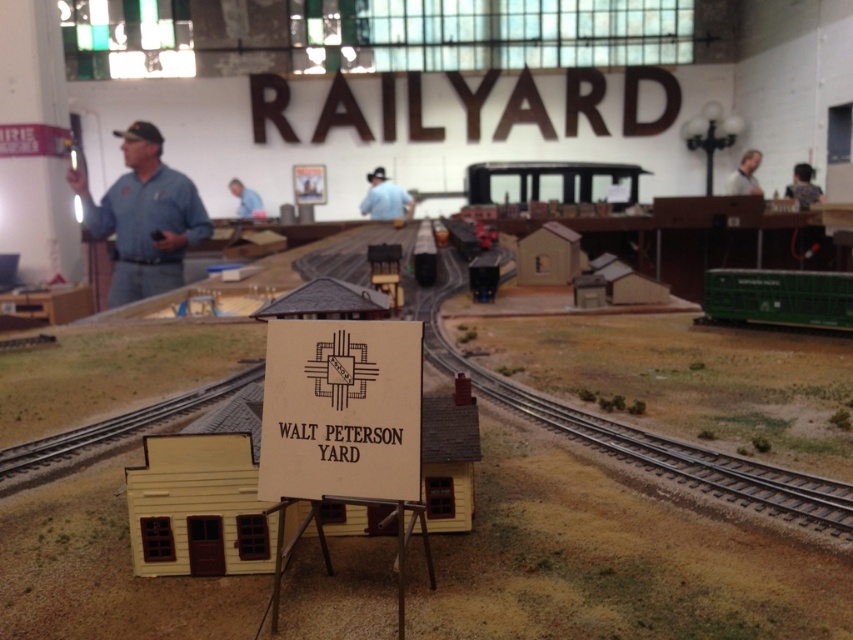
Question: Among these objects, which one is nearest to the camera?

Choices:
 (A) green matte freight car at right
 (B) blue shirt at upper center
 (C) blue uniform at center
 (D) brown cardboard sign at center

Answer: (D)

Question: Does green matte freight car at right lie in front of blue shirt at upper center?

Choices:
 (A) no
 (B) yes

Answer: (B)

Question: Can you confirm if green matte freight car at right is positioned to the right of blue uniform at center?

Choices:
 (A) no
 (B) yes

Answer: (B)

Question: Which is nearer to the blue denim shirt at left?

Choices:
 (A) brown cardboard sign at center
 (B) blue uniform at center
 (C) light blue shirt at upper right
 (D) blue shirt at upper center

Answer: (D)

Question: Which point appears farthest from the camera in this image?

Choices:
 (A) (820, 188)
 (B) (229, 189)

Answer: (B)

Question: Is light blue shirt at upper right behind blue shirt at upper center?

Choices:
 (A) yes
 (B) no

Answer: (B)